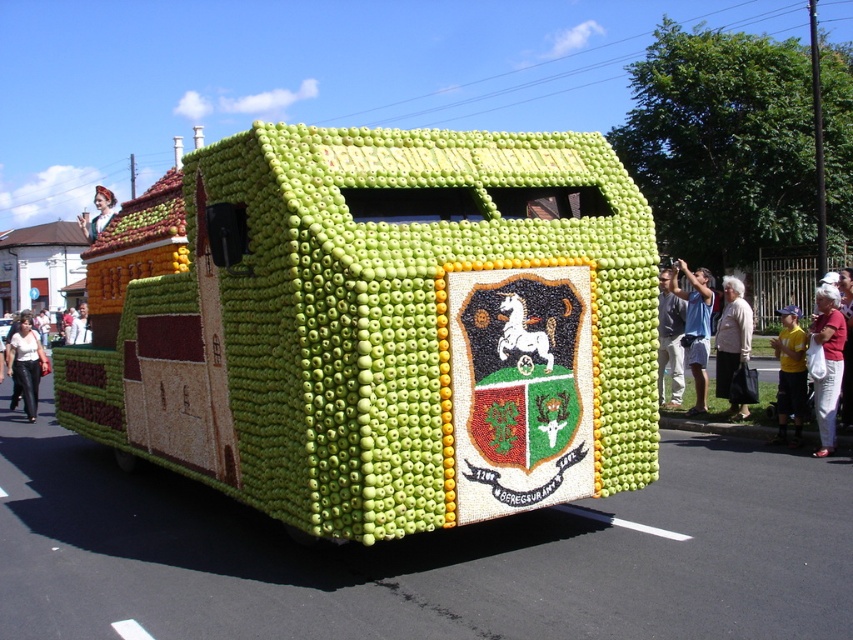
Does white cotton bag at lower right appear over light blue t-shirt at center?

Incorrect, white cotton bag at lower right is not positioned above light blue t-shirt at center.

This screenshot has height=640, width=853. What do you see at coordinates (827, 364) in the screenshot?
I see `white cotton bag at lower right` at bounding box center [827, 364].

Identify the location of white cotton bag at lower right. The image size is (853, 640). (827, 364).

Looking at this image, is matte green apple at center taller than white fabric shirt at left?

Yes, matte green apple at center is taller than white fabric shirt at left.

Is matte green apple at center closer to the viewer compared to white fabric shirt at left?

Yes.

This screenshot has height=640, width=853. In order to click on matte green apple at center in this screenshot , I will do `click(670, 339)`.

Who is positioned more to the left, matte green apple at center or white leather pants at lower left?

From the viewer's perspective, white leather pants at lower left appears more on the left side.

Does matte green apple at center appear over white leather pants at lower left?

Correct, matte green apple at center is located above white leather pants at lower left.

Between point (672, 324) and point (18, 333), which one is positioned in front?

Point (672, 324) is more forward.

Where is `matte green apple at center`? This screenshot has height=640, width=853. matte green apple at center is located at coordinates (670, 339).